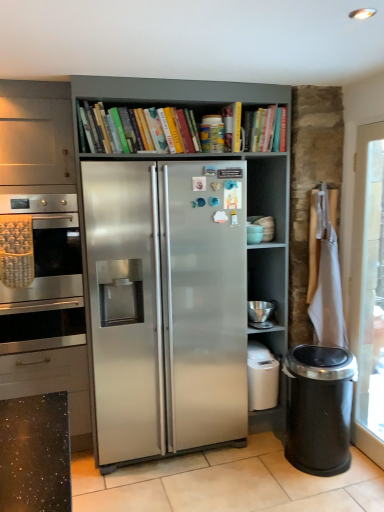
Question: In the image, is silver metallic bowl at lower right, the second appliance when ordered from top to bottom, positioned in front of or behind satin silver fridge at center?

Choices:
 (A) behind
 (B) front

Answer: (A)

Question: Considering the relative positions of silver metallic bowl at lower right, the second appliance when ordered from top to bottom, and satin silver fridge at center in the image provided, is silver metallic bowl at lower right, the second appliance when ordered from top to bottom, to the left or to the right of satin silver fridge at center?

Choices:
 (A) right
 (B) left

Answer: (A)

Question: Which is farther from the stainless steel oven at left?

Choices:
 (A) white glossy tile at center
 (B) black plastic trash can at lower right
 (C) matte ceramic bowls at upper right, which is the first appliance from top to bottom
 (D) hardcover book at upper center
 (E) silver metallic bowl at lower right, which is counted as the 1th appliance, starting from the bottom

Answer: (B)

Question: Estimate the real-world distances between objects in this image. Which object is closer to the black plastic trash can at lower right?

Choices:
 (A) silver metallic bowl at lower right, which is counted as the 1th appliance, starting from the bottom
 (B) white glossy tile at center
 (C) matte ceramic bowls at upper right, which is the first appliance from top to bottom
 (D) white plastic dish washer at lower right
 (E) stainless steel oven at left

Answer: (D)